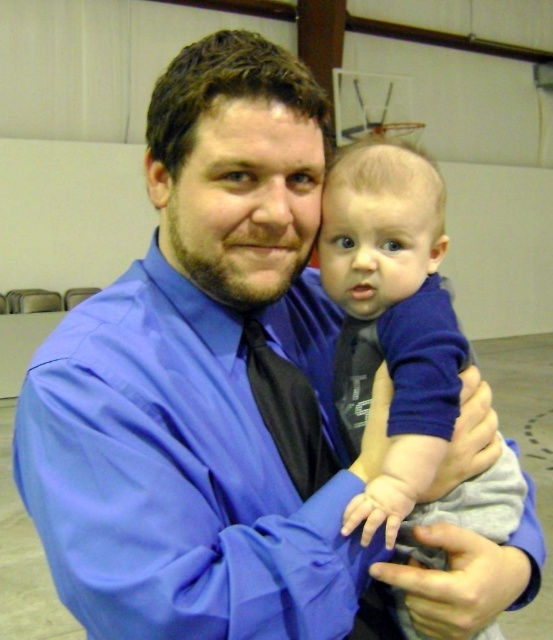
Which of these two, blue soft baby at center or black satin tie at center, stands shorter?

black satin tie at center

Does point (398, 266) come behind point (291, 445)?

Yes, point (398, 266) is behind point (291, 445).

Is point (409, 196) less distant than point (309, 483)?

No, it is not.

Locate an element on the screen. blue soft baby at center is located at coordinates [x=401, y=339].